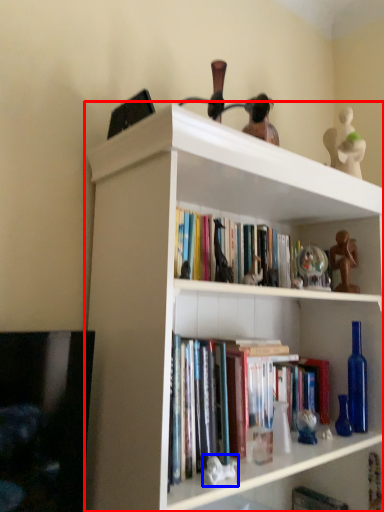
Question: Which object is further to the camera taking this photo, shelf (highlighted by a red box) or toy (highlighted by a blue box)?

Choices:
 (A) shelf
 (B) toy

Answer: (B)